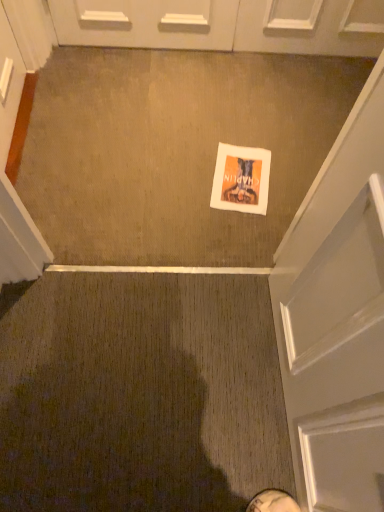
This screenshot has height=512, width=384. What are the coordinates of `free space in front of white paper flyer at center` in the screenshot? It's located at (228, 227).